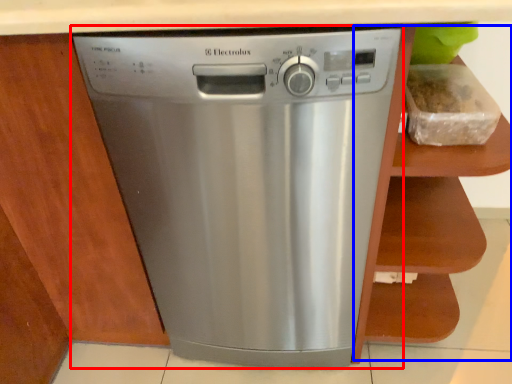
Question: Among these objects, which one is farthest to the camera, home appliance (highlighted by a red box) or cabinet (highlighted by a blue box)?

Choices:
 (A) home appliance
 (B) cabinet

Answer: (A)